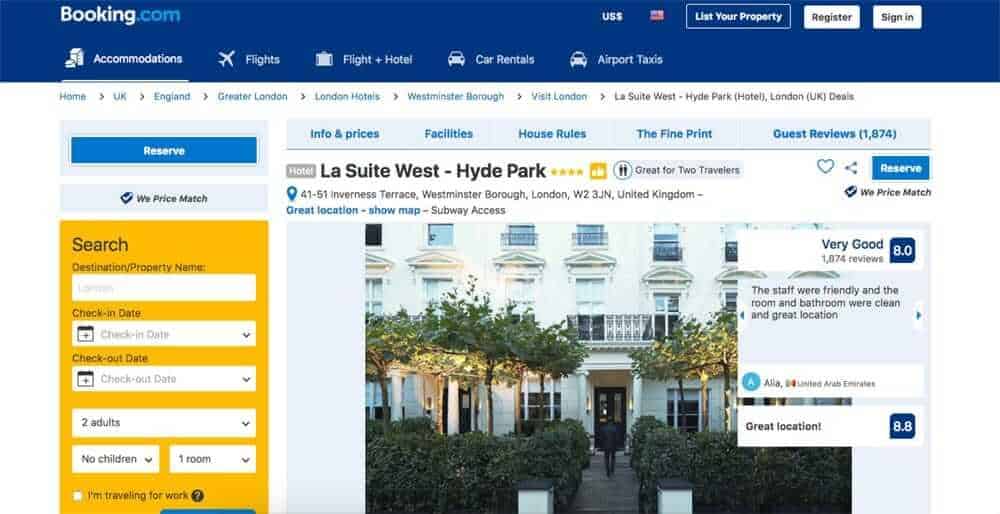
Where is `door`? door is located at coordinates (607, 393).